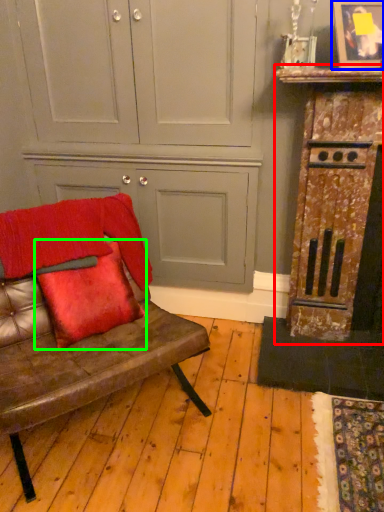
Question: Which object is positioned closest to dresser (highlighted by a red box)? Select from picture frame (highlighted by a blue box) and pillow (highlighted by a green box).

Choices:
 (A) picture frame
 (B) pillow

Answer: (A)